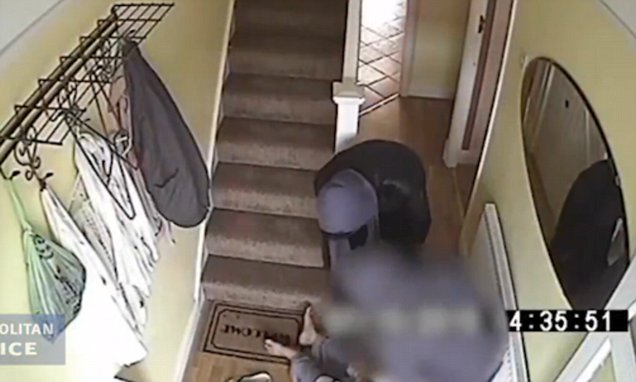
Identify the location of mirror. (565, 81), (577, 142), (541, 139), (543, 218), (570, 258), (582, 246), (572, 203), (554, 108).